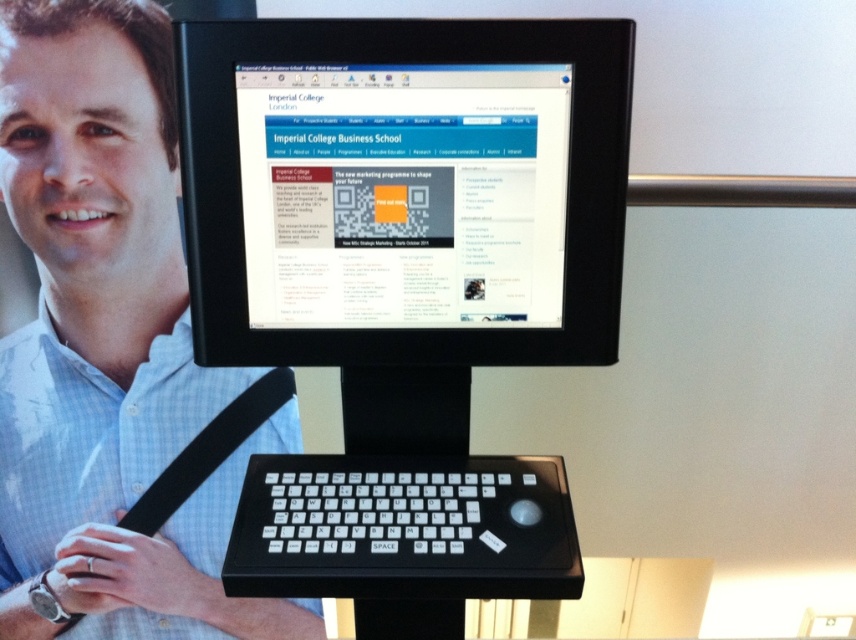
Does black plastic monitor at center have a greater width compared to matte black keyboard at lower center?

Yes, black plastic monitor at center is wider than matte black keyboard at lower center.

Between point (289, 200) and point (15, 40), which one is positioned in front?

Positioned in front is point (289, 200).

Image resolution: width=856 pixels, height=640 pixels. Describe the element at coordinates (403, 285) in the screenshot. I see `black plastic monitor at center` at that location.

Identify the location of black plastic monitor at center. (403, 285).

Is black plastic monitor at center to the right of black plastic keyboard at center from the viewer's perspective?

Incorrect, black plastic monitor at center is not on the right side of black plastic keyboard at center.

Is black plastic monitor at center closer to the viewer compared to black plastic keyboard at center?

No, it is not.

Who is more distant from viewer, (468, 113) or (515, 579)?

Point (468, 113)

Where is `black plastic monitor at center`? The width and height of the screenshot is (856, 640). black plastic monitor at center is located at coordinates tap(403, 285).

Consider the image. Does matte black keyboard at lower center appear on the right side of black plastic keyboard at center?

In fact, matte black keyboard at lower center is to the left of black plastic keyboard at center.

Measure the distance between matte black keyboard at lower center and camera.

matte black keyboard at lower center and camera are 3.76 feet apart.

Which is in front, point (152, 172) or point (397, 512)?

Positioned in front is point (397, 512).

Locate an element on the screen. The height and width of the screenshot is (640, 856). matte black keyboard at lower center is located at coordinates 110,342.